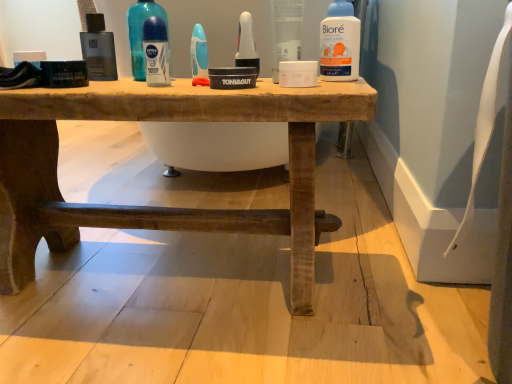
Find the location of a particular element. vacant space positioned to the left of transparent plastic deodorant at center, the 2th mouthwash viewed from the left is located at coordinates (79, 82).